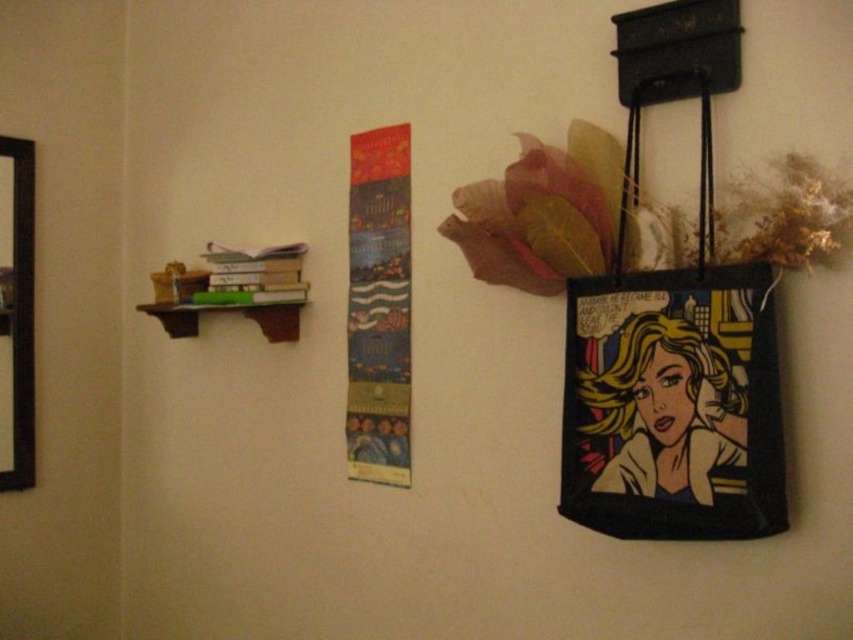
Which is in front, point (669, 484) or point (358, 387)?

Positioned in front is point (669, 484).

Is pop art tote bag at upper right wider than textured fabric banner at center?

Correct, the width of pop art tote bag at upper right exceeds that of textured fabric banner at center.

The image size is (853, 640). Describe the element at coordinates (665, 410) in the screenshot. I see `pop art tote bag at upper right` at that location.

I want to click on pop art tote bag at upper right, so click(x=665, y=410).

Measure the distance between textured fabric banner at center and black wooden picture frame at left.

88.53 centimeters

Can you confirm if textured fabric banner at center is smaller than black wooden picture frame at left?

Actually, textured fabric banner at center might be larger than black wooden picture frame at left.

You are a GUI agent. You are given a task and a screenshot of the screen. Output one action in this format:
    pyautogui.click(x=<x>, y=<y>)
    Task: Click on the textured fabric banner at center
    
    Given the screenshot: What is the action you would take?
    pyautogui.click(x=378, y=307)

Between pop art tote bag at upper right and black wooden picture frame at left, which one appears on the left side from the viewer's perspective?

Positioned to the left is black wooden picture frame at left.

Is pop art tote bag at upper right wider than black wooden picture frame at left?

Correct, the width of pop art tote bag at upper right exceeds that of black wooden picture frame at left.

The image size is (853, 640). I want to click on pop art tote bag at upper right, so click(665, 410).

This screenshot has height=640, width=853. What are the coordinates of `pop art tote bag at upper right` in the screenshot? It's located at (665, 410).